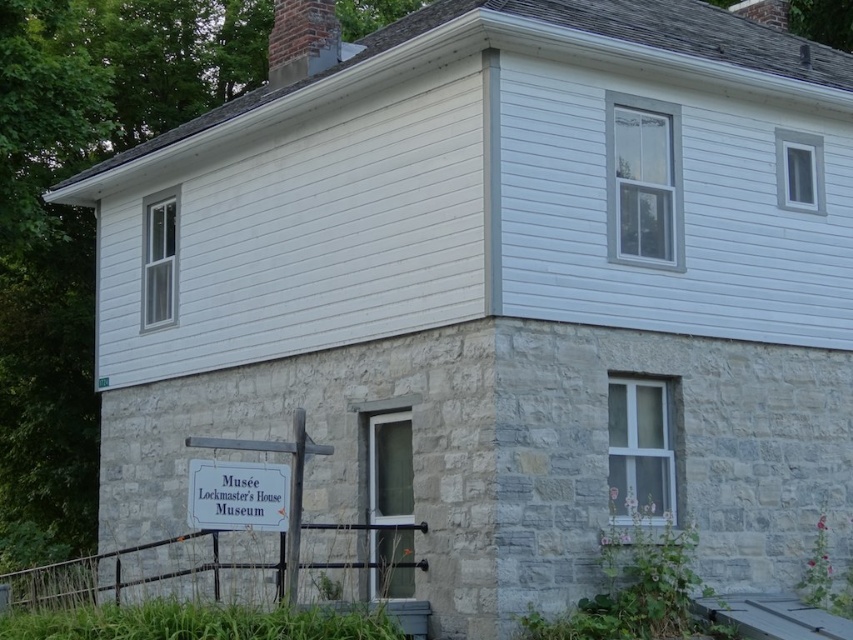
Question: Can you confirm if white wooden sign at lower center is thinner than gray stone chimney at upper center?

Choices:
 (A) yes
 (B) no

Answer: (A)

Question: Among these objects, which one is farthest from the camera?

Choices:
 (A) white wooden sign at lower center
 (B) gray stone chimney at upper center

Answer: (B)

Question: Which point is farther from the camera taking this photo?

Choices:
 (A) (244, 504)
 (B) (283, 77)

Answer: (B)

Question: Is white wooden sign at lower center closer to the viewer compared to gray stone chimney at upper center?

Choices:
 (A) yes
 (B) no

Answer: (A)

Question: Is the position of white wooden sign at lower center more distant than that of gray stone chimney at upper center?

Choices:
 (A) yes
 (B) no

Answer: (B)